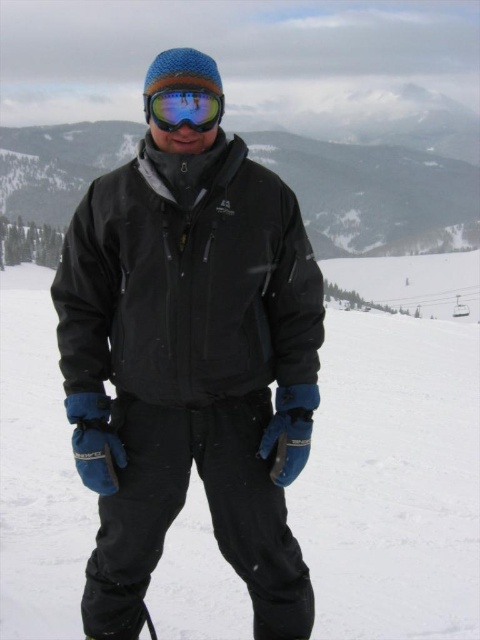
Question: Which of the following is the farthest from the observer?

Choices:
 (A) (237, 600)
 (B) (180, 90)

Answer: (A)

Question: Which point is closer to the camera taking this photo?

Choices:
 (A) tap(291, 572)
 (B) tap(223, 99)

Answer: (A)

Question: Among these points, which one is nearest to the camera?

Choices:
 (A) (48, 572)
 (B) (166, 118)
 (C) (117, 324)

Answer: (B)

Question: Does black softshell jacket at center have a smaller size compared to white matte snow at center?

Choices:
 (A) yes
 (B) no

Answer: (A)

Question: Can you confirm if black softshell jacket at center is wider than glossy plastic goggles at center?

Choices:
 (A) no
 (B) yes

Answer: (B)

Question: Where is white matte snow at center located in relation to glossy plastic goggles at center in the image?

Choices:
 (A) below
 (B) above

Answer: (B)